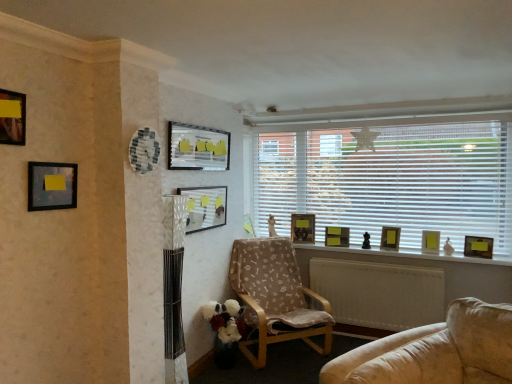
The width and height of the screenshot is (512, 384). I want to click on free location to the right of yellow matte picture frame at window, placed as the 3th picture frame when sorted from right to left, so click(x=409, y=250).